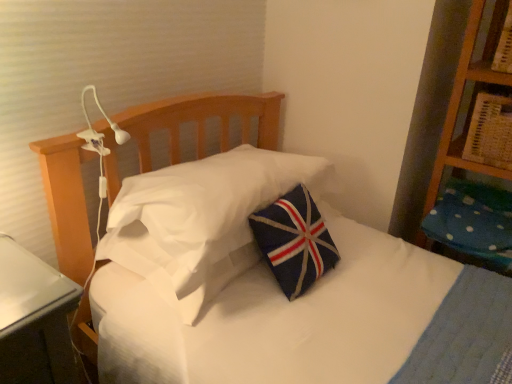
Question: Is blue dotted fabric pillow at right, acting as the 2th pillow starting from the left, positioned before wooden bookshelf at upper right?

Choices:
 (A) yes
 (B) no

Answer: (B)

Question: Is blue dotted fabric pillow at right, acting as the 2th pillow starting from the left, to the left of wooden bookshelf at upper right from the viewer's perspective?

Choices:
 (A) yes
 (B) no

Answer: (B)

Question: Would you say wooden bookshelf at upper right is part of blue dotted fabric pillow at right, acting as the 2th pillow starting from the left,'s contents?

Choices:
 (A) yes
 (B) no

Answer: (B)

Question: Can you confirm if blue dotted fabric pillow at right, acting as the first pillow starting from the right, is taller than wooden bookshelf at upper right?

Choices:
 (A) no
 (B) yes

Answer: (A)

Question: Is blue dotted fabric pillow at right, acting as the 2th pillow starting from the left, outside of wooden bookshelf at upper right?

Choices:
 (A) yes
 (B) no

Answer: (A)

Question: Could you tell me if blue dotted fabric pillow at right, acting as the first pillow starting from the right, is facing wooden bookshelf at upper right?

Choices:
 (A) no
 (B) yes

Answer: (A)

Question: Can you confirm if navy felt pillow at center, the 2th pillow in the right-to-left sequence, is wider than wooden bookshelf at upper right?

Choices:
 (A) yes
 (B) no

Answer: (A)

Question: Is navy felt pillow at center, placed as the 1th pillow when sorted from left to right, positioned behind wooden bookshelf at upper right?

Choices:
 (A) no
 (B) yes

Answer: (A)

Question: Is navy felt pillow at center, the 2th pillow in the right-to-left sequence, positioned before wooden bookshelf at upper right?

Choices:
 (A) yes
 (B) no

Answer: (A)

Question: Is navy felt pillow at center, the 2th pillow in the right-to-left sequence, located outside wooden bookshelf at upper right?

Choices:
 (A) yes
 (B) no

Answer: (A)

Question: Considering the relative sizes of navy felt pillow at center, placed as the 1th pillow when sorted from left to right, and wooden bookshelf at upper right in the image provided, is navy felt pillow at center, placed as the 1th pillow when sorted from left to right, taller than wooden bookshelf at upper right?

Choices:
 (A) yes
 (B) no

Answer: (B)

Question: Can you confirm if navy felt pillow at center, the 2th pillow in the right-to-left sequence, is thinner than wooden bookshelf at upper right?

Choices:
 (A) yes
 (B) no

Answer: (B)

Question: Considering the relative positions of blue dotted fabric pillow at right, acting as the 2th pillow starting from the left, and navy felt pillow at center, the 2th pillow in the right-to-left sequence, in the image provided, is blue dotted fabric pillow at right, acting as the 2th pillow starting from the left, behind navy felt pillow at center, the 2th pillow in the right-to-left sequence,?

Choices:
 (A) yes
 (B) no

Answer: (A)